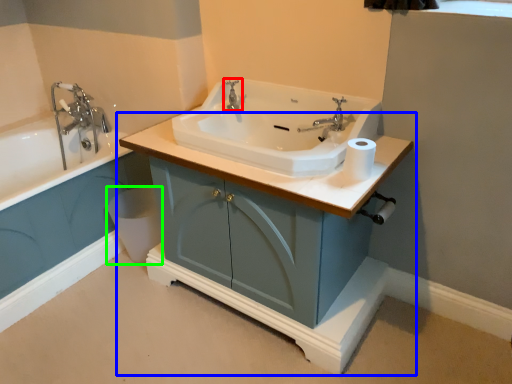
Question: Considering the real-world distances, which object is farthest from tap (highlighted by a red box)? bathroom cabinet (highlighted by a blue box) or toilet bowl (highlighted by a green box)?

Choices:
 (A) bathroom cabinet
 (B) toilet bowl

Answer: (B)